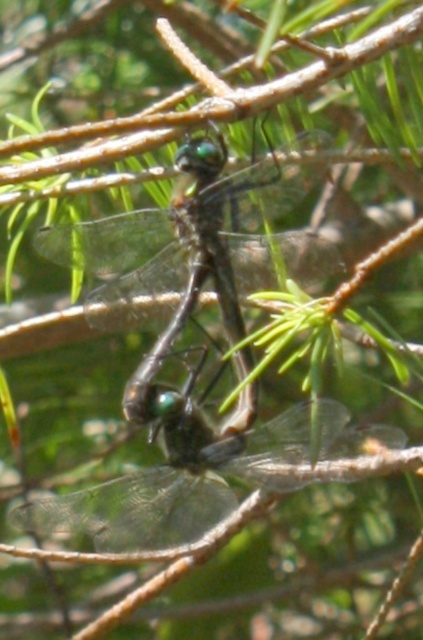
Question: Among these points, which one is nearest to the camera?

Choices:
 (A) (209, 196)
 (B) (370, 467)

Answer: (B)

Question: From the image, what is the correct spatial relationship of transparent winged dragonfly at center in relation to transparent glass dragonfly at center?

Choices:
 (A) left
 (B) right

Answer: (A)

Question: Does transparent winged dragonfly at center appear on the left side of transparent glass dragonfly at center?

Choices:
 (A) no
 (B) yes

Answer: (B)

Question: Is transparent winged dragonfly at center positioned at the back of transparent glass dragonfly at center?

Choices:
 (A) no
 (B) yes

Answer: (A)

Question: Which point appears closest to the camera in this image?

Choices:
 (A) (129, 296)
 (B) (134, 509)

Answer: (B)